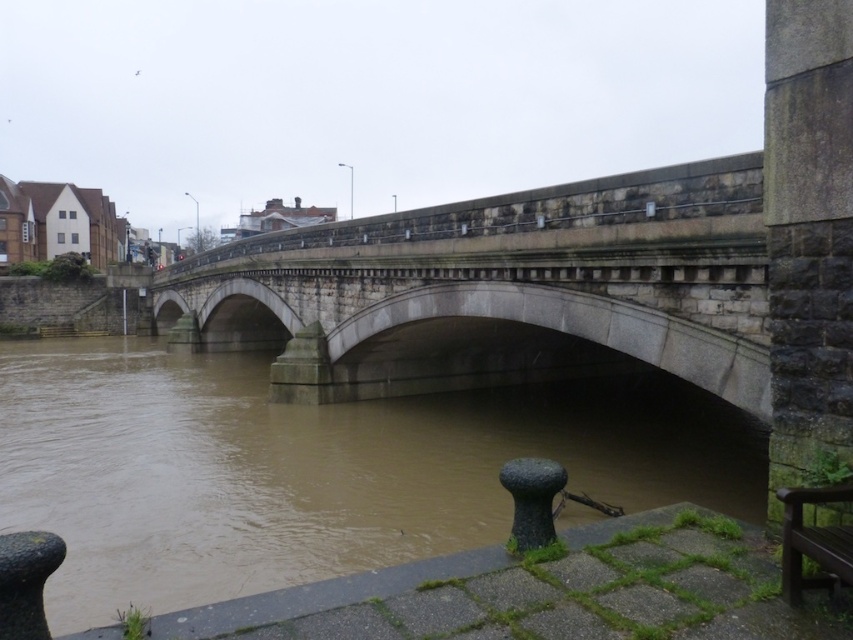
Which is in front, point (171, 444) or point (537, 193)?

Positioned in front is point (537, 193).

Who is positioned more to the left, brown muddy water at center or stone bridge at center?

Positioned to the left is stone bridge at center.

Who is more forward, (521, 396) or (396, 381)?

Point (396, 381) is more forward.

What are the coordinates of `brown muddy water at center` in the screenshot? It's located at (312, 468).

Between point (498, 403) and point (834, 486), which one is positioned behind?

Positioned behind is point (498, 403).

At what (x,y) coordinates should I click in order to perform the action: click on brown muddy water at center. Please return your answer as a coordinate pair (x, y). The height and width of the screenshot is (640, 853). Looking at the image, I should click on (312, 468).

Is stone bridge at center above wooden park bench at lower right?

Indeed, stone bridge at center is positioned over wooden park bench at lower right.

Is stone bridge at center positioned before wooden park bench at lower right?

No, it is behind wooden park bench at lower right.

Is point (515, 365) less distant than point (795, 486)?

No.

Where is `stone bridge at center`? stone bridge at center is located at coordinates (500, 291).